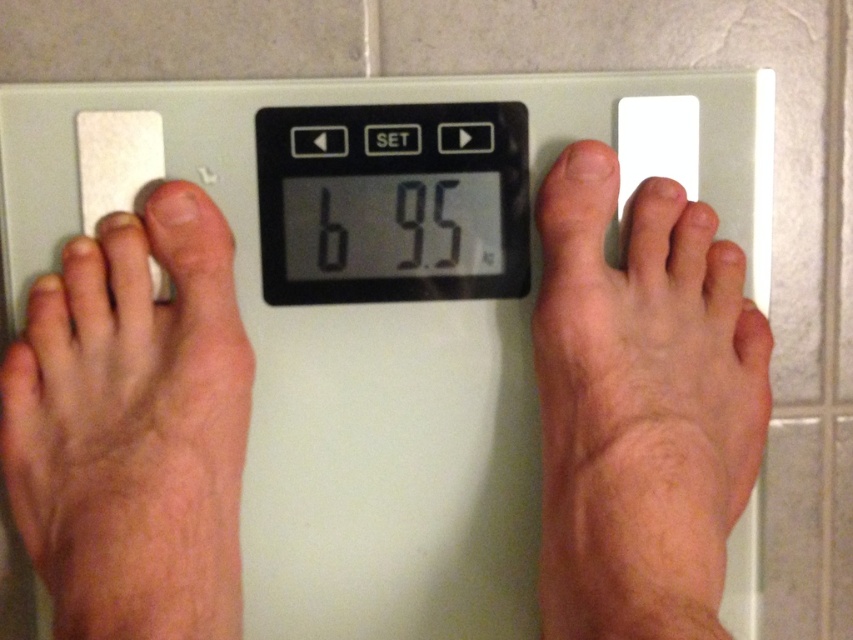
You are a fitness trainer assessing a client who is standing on a digital bathroom scale. The scale has a rectangular surface with a digital display in the center. You notice the client has skinny bare feet at center and pink skin at left. Based on the scale design, which part of the client might be wider?

The skinny bare feet at center might be wider than the pink skin at left.